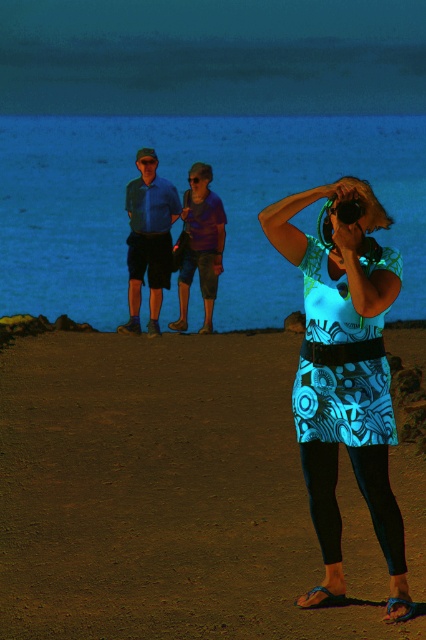
You are a photographer trying to capture a group photo of the two people in the center. The blue printed skirt at center and the blue cotton shirt at center are standing too close together. Which one should you ask to move to the left to create space?

The blue printed skirt at center is positioned on the right side of the blue cotton shirt at center, so you should ask the blue printed skirt at center to move to the left to create space between them.

You are standing on the beach at twilight and notice the blue printed skirt at center. Based on its position, can you determine if it is closer to the camera or further away compared to the woman on the right holding the camera?

The blue printed skirt at center is located at point (169, 496), which indicates it is closer to the camera than the woman on the right holding the camera.

You are a photographer trying to capture a group photo of the two people at the center. The patterned fabric dress at center and the purple cotton shirt at center are both in the frame. Which of these two should you focus on first to ensure they are in focus?

The patterned fabric dress at center is taller than the purple cotton shirt at center, so you should focus on the patterned fabric dress at center first since it is closer to the camera.